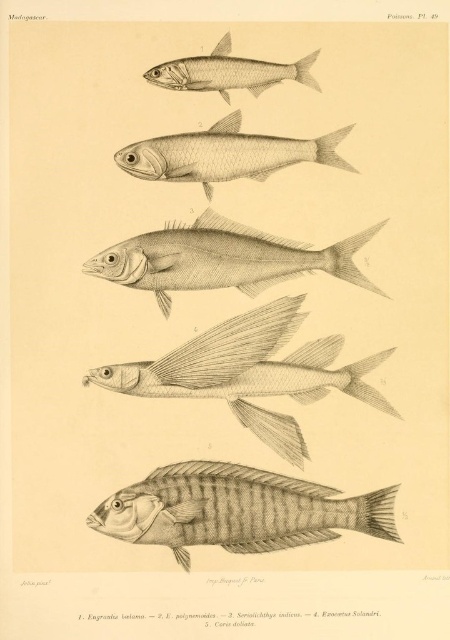
Is gray pencil sketch of fish at upper center positioned before gray striped fish at lower center?

No, it is behind gray striped fish at lower center.

Does point (256, 332) come in front of point (311, 529)?

No, (256, 332) is further to viewer.

What do you see at coordinates (251, 372) in the screenshot? The width and height of the screenshot is (450, 640). I see `gray pencil sketch of fish at upper center` at bounding box center [251, 372].

You are a GUI agent. You are given a task and a screenshot of the screen. Output one action in this format:
    pyautogui.click(x=<x>, y=<y>)
    Task: Click on the gray pencil sketch of fish at upper center
    The image size is (450, 640).
    Given the screenshot: What is the action you would take?
    pyautogui.click(x=251, y=372)

Who is shorter, grayish-white sketch at center or grayish silver fish at center?

With less height is grayish silver fish at center.

Who is more distant from viewer, (176,260) or (217,124)?

The point (176,260) is behind.

Image resolution: width=450 pixels, height=640 pixels. What do you see at coordinates (220, 259) in the screenshot?
I see `grayish-white sketch at center` at bounding box center [220, 259].

You are a GUI agent. You are given a task and a screenshot of the screen. Output one action in this format:
    pyautogui.click(x=<x>, y=<y>)
    Task: Click on the grayish-white sketch at center
    
    Given the screenshot: What is the action you would take?
    pyautogui.click(x=220, y=259)

In the scene shown: Between gray pencil sketch of fish at upper center and grayish silver fish at center, which one is positioned lower?

gray pencil sketch of fish at upper center

Between point (279, 518) and point (208, 147), which one is positioned in front?

Point (279, 518) is in front.

Does point (376, 225) come closer to viewer compared to point (296, 148)?

Yes, it is in front of point (296, 148).

I want to click on gray pencil sketch of fish at upper center, so click(x=251, y=372).